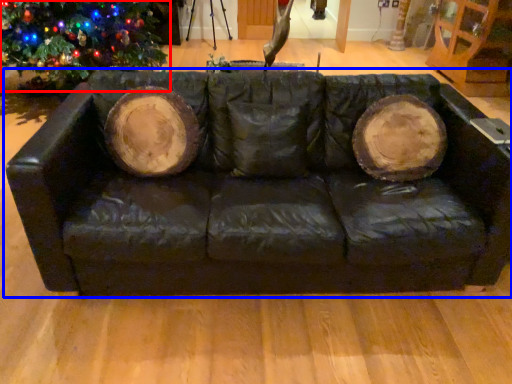
Question: Which point is closer to the camera, christmas tree (highlighted by a red box) or studio couch (highlighted by a blue box)?

Choices:
 (A) christmas tree
 (B) studio couch

Answer: (B)